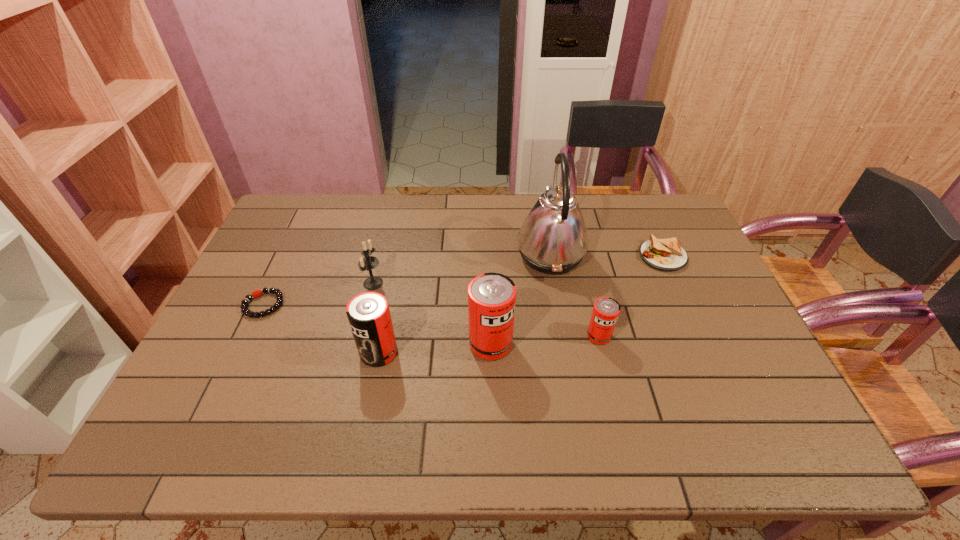
The width and height of the screenshot is (960, 540). Identify the location of object situated at the left edge. (257, 293).

Identify the location of object that is at the right edge. Image resolution: width=960 pixels, height=540 pixels. (666, 254).

You are a GUI agent. You are given a task and a screenshot of the screen. Output one action in this format:
    pyautogui.click(x=<x>, y=<y>)
    Task: Click on the vacant space at the far edge of the desktop
    
    Given the screenshot: What is the action you would take?
    pyautogui.click(x=626, y=232)

At what (x,y) coordinates should I click in order to perform the action: click on free region at the near edge of the desktop. Please return your answer as a coordinate pair (x, y). The width and height of the screenshot is (960, 540). Looking at the image, I should click on (602, 398).

I want to click on free spot at the left edge of the desktop, so click(208, 370).

In the image, there is a desktop. What are the coordinates of `free region at the right edge` in the screenshot? It's located at (699, 250).

The width and height of the screenshot is (960, 540). What are the coordinates of `vacant space at the far left corner of the desktop` in the screenshot? It's located at (297, 230).

You are a GUI agent. You are given a task and a screenshot of the screen. Output one action in this format:
    pyautogui.click(x=<x>, y=<y>)
    Task: Click on the vacant area at the near left corner of the desktop
    The height and width of the screenshot is (540, 960).
    Given the screenshot: What is the action you would take?
    pyautogui.click(x=213, y=377)

The width and height of the screenshot is (960, 540). What are the coordinates of `vacant space at the far right corner of the desktop` in the screenshot? It's located at 639,222.

Locate an element on the screen. The height and width of the screenshot is (540, 960). free spot between the candle holder and the second can from right to left is located at coordinates click(432, 314).